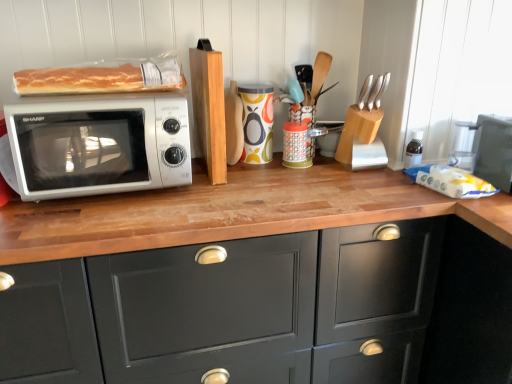
Question: Is wooden knife block at center, arranged as the third appliance when viewed from the right, taller or shorter than translucent plastic bread at upper left?

Choices:
 (A) short
 (B) tall

Answer: (B)

Question: Is point (332, 137) positioned closer to the camera than point (79, 76)?

Choices:
 (A) farther
 (B) closer

Answer: (A)

Question: Based on their relative distances, which object is farther from the satin silver microwave at left?

Choices:
 (A) colorful ceramic mug at center, which ranks as the 4th appliance in right-to-left order
 (B) wooden knife block at center, which is counted as the 2th appliance, starting from the left
 (C) wooden knife block at upper right, the second appliance viewed from the right
 (D) matte black toaster oven at right, acting as the 1th appliance starting from the right
 (E) silver metallic knife block at upper right

Answer: (D)

Question: Estimate the real-world distances between objects in this image. Which object is closer to the satin silver microwave at left?

Choices:
 (A) translucent plastic bread at upper left
 (B) matte black toaster oven at right, acting as the 1th appliance starting from the right
 (C) wooden knife block at upper right, placed as the third appliance when sorted from left to right
 (D) silver metallic knife block at upper right
 (E) light brown wooden block at center

Answer: (A)